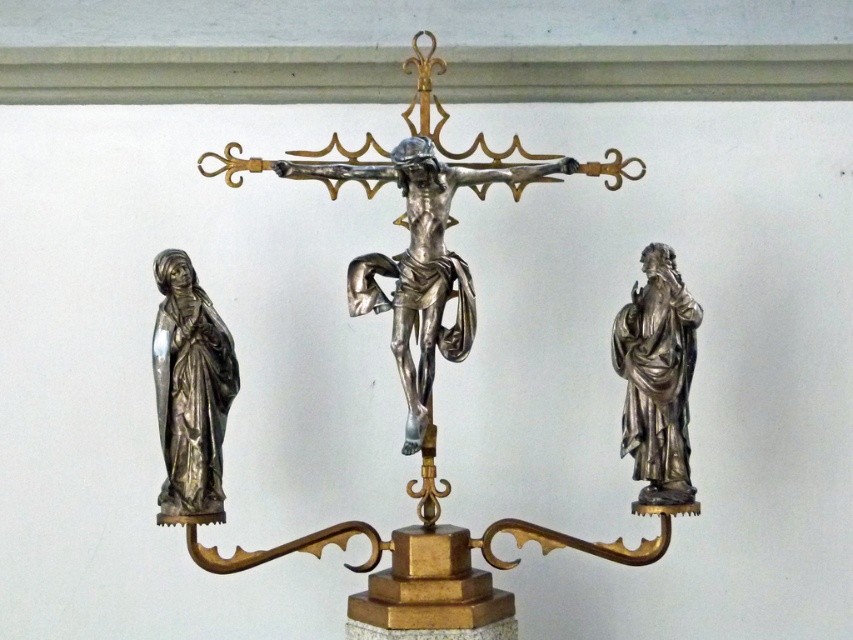
Question: Which object is closer to the camera taking this photo?

Choices:
 (A) polished silver statue at right
 (B) polished silver statue at left

Answer: (B)

Question: Where is polished silver statue at left located in relation to polished silver statue at right in the image?

Choices:
 (A) left
 (B) right

Answer: (A)

Question: Is the position of polished silver statue at left less distant than that of polished silver statue at right?

Choices:
 (A) yes
 (B) no

Answer: (A)

Question: Does polished silver statue at left have a smaller size compared to polished silver statue at right?

Choices:
 (A) no
 (B) yes

Answer: (B)